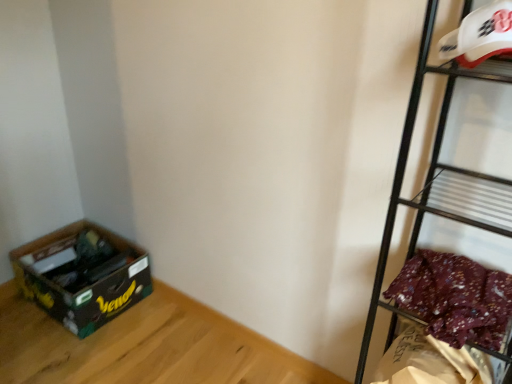
Question: Would you say matte black box at lower left is a long distance from metallic black shelf at right, the 2th shelf positioned from the top?

Choices:
 (A) yes
 (B) no

Answer: (B)

Question: From a real-world perspective, is matte black box at lower left beneath metallic black shelf at right, which appears as the 1th shelf when ordered from the bottom?

Choices:
 (A) yes
 (B) no

Answer: (A)

Question: Is matte black box at lower left positioned behind metallic black shelf at right, which appears as the 1th shelf when ordered from the bottom?

Choices:
 (A) yes
 (B) no

Answer: (A)

Question: Does matte black box at lower left have a lesser width compared to metallic black shelf at right, which appears as the 1th shelf when ordered from the bottom?

Choices:
 (A) yes
 (B) no

Answer: (B)

Question: Is matte black box at lower left at the right side of metallic black shelf at right, which appears as the 1th shelf when ordered from the bottom?

Choices:
 (A) no
 (B) yes

Answer: (A)

Question: From a real-world perspective, is floral fabric at right above or below white plastic helmet at upper right, marked as the 1th shelf in a top-to-bottom arrangement?

Choices:
 (A) below
 (B) above

Answer: (A)

Question: Based on their positions, is floral fabric at right located to the left or right of white plastic helmet at upper right, marked as the 1th shelf in a top-to-bottom arrangement?

Choices:
 (A) left
 (B) right

Answer: (B)

Question: Considering the positions of floral fabric at right and white plastic helmet at upper right, marked as the 2th shelf in a bottom-to-top arrangement, in the image, is floral fabric at right wider or thinner than white plastic helmet at upper right, marked as the 2th shelf in a bottom-to-top arrangement,?

Choices:
 (A) wide
 (B) thin

Answer: (A)

Question: Is floral fabric at right bigger or smaller than white plastic helmet at upper right, marked as the 2th shelf in a bottom-to-top arrangement?

Choices:
 (A) big
 (B) small

Answer: (A)

Question: Choose the correct answer: Is floral fabric at right inside green cardboard box at lower left or outside it?

Choices:
 (A) inside
 (B) outside

Answer: (B)

Question: Is point pyautogui.click(x=496, y=312) positioned closer to the camera than point pyautogui.click(x=124, y=274)?

Choices:
 (A) farther
 (B) closer

Answer: (B)

Question: From the image's perspective, is floral fabric at right positioned above or below green cardboard box at lower left?

Choices:
 (A) above
 (B) below

Answer: (A)

Question: Visually, is floral fabric at right positioned to the left or to the right of green cardboard box at lower left?

Choices:
 (A) left
 (B) right

Answer: (B)

Question: Considering the relative positions of floral fabric at right and matte black box at lower left in the image provided, is floral fabric at right to the left or to the right of matte black box at lower left?

Choices:
 (A) left
 (B) right

Answer: (B)

Question: From a real-world perspective, is floral fabric at right physically located above or below matte black box at lower left?

Choices:
 (A) above
 (B) below

Answer: (A)